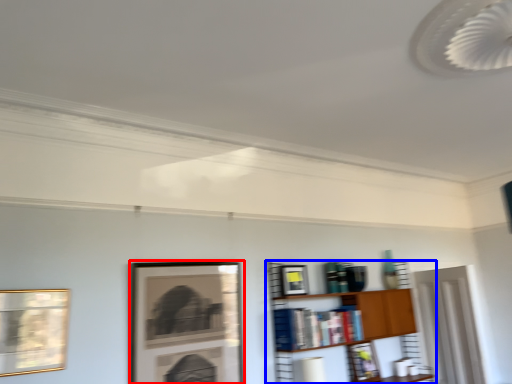
Question: Among these objects, which one is nearest to the camera, picture frame (highlighted by a red box) or shelf (highlighted by a blue box)?

Choices:
 (A) picture frame
 (B) shelf

Answer: (A)